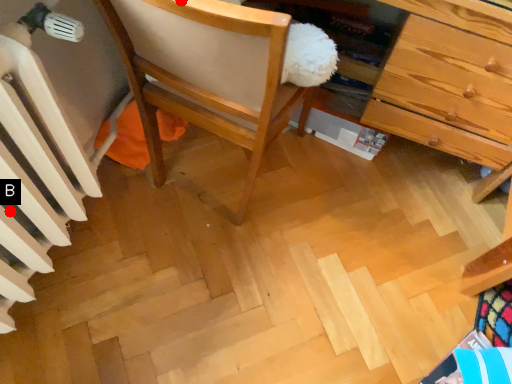
Question: Two points are circled on the image, labeled by A and B beside each circle. Which point is farther from the camera taking this photo?

Choices:
 (A) A is further
 (B) B is further

Answer: (B)